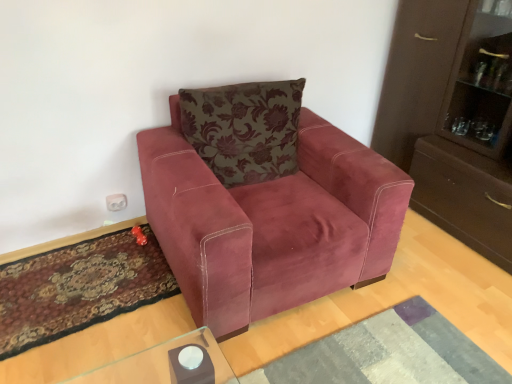
The width and height of the screenshot is (512, 384). Identify the location of free location to the left of velvet pink armchair at center. (89, 284).